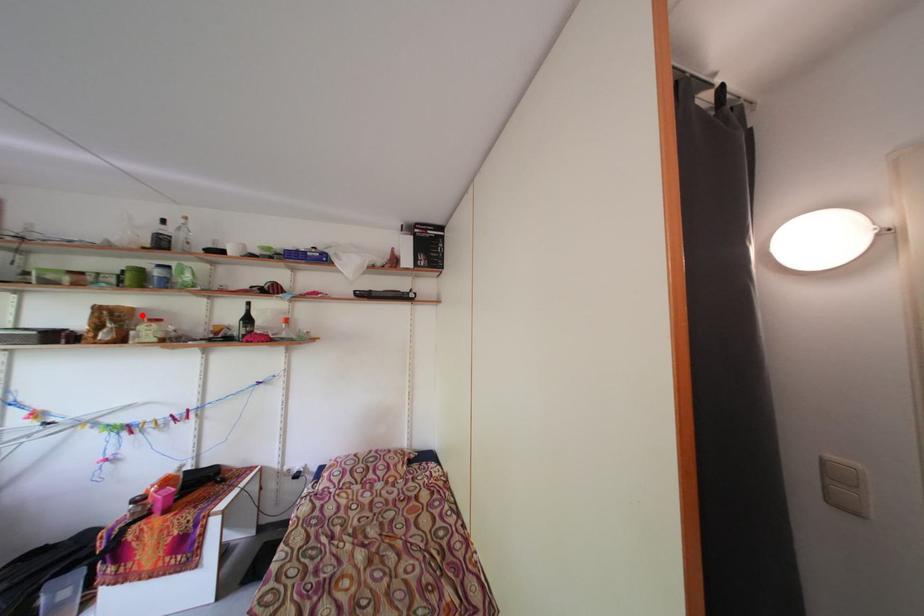
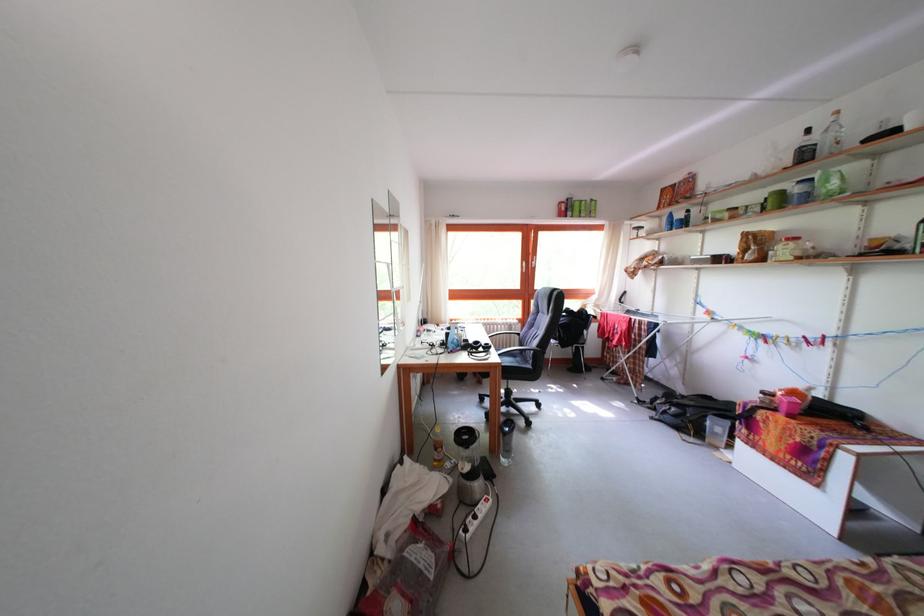
Question: I am providing you with two images of the same scene from different viewpoints. A red point is marked on the first image. At the location where the point appears in image 1, is it still visible in image 2?

Choices:
 (A) Yes
 (B) No

Answer: (A)